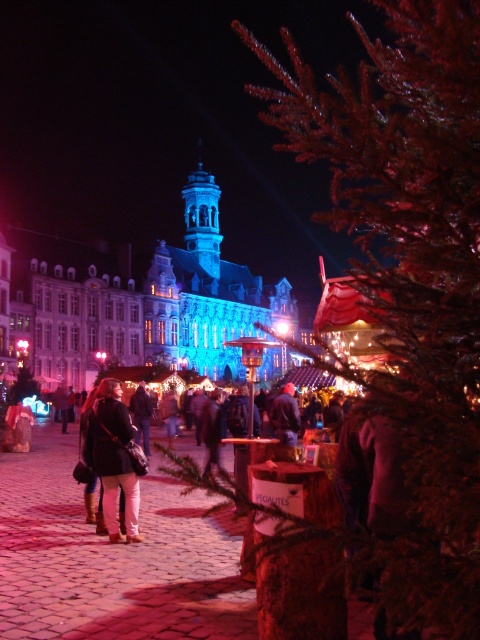
You are standing in the festive market scene. You see a green textured pine tree at center and a dark blue jacket at center. How far apart are these two items from each other?

The green textured pine tree at center and dark blue jacket at center are 38.05 meters apart.

You are standing in the festive market scene and want to move from the Christmas tree to the cobblestone path. Which point, point (x=432, y=397) or point (x=117, y=525), is closer to you as you navigate towards the path?

Point (x=432, y=397) is closer to the viewer than point (x=117, y=525), so you should head towards that point first.

You are trying to decide which jacket to wear for a cold evening walk. Both the matte black jacket at center and the dark blue jacket at center are available. If you want a wider jacket for better coverage, which one should you choose?

The matte black jacket at center has a larger width than the dark blue jacket at center, so you should choose the matte black jacket at center for better coverage.